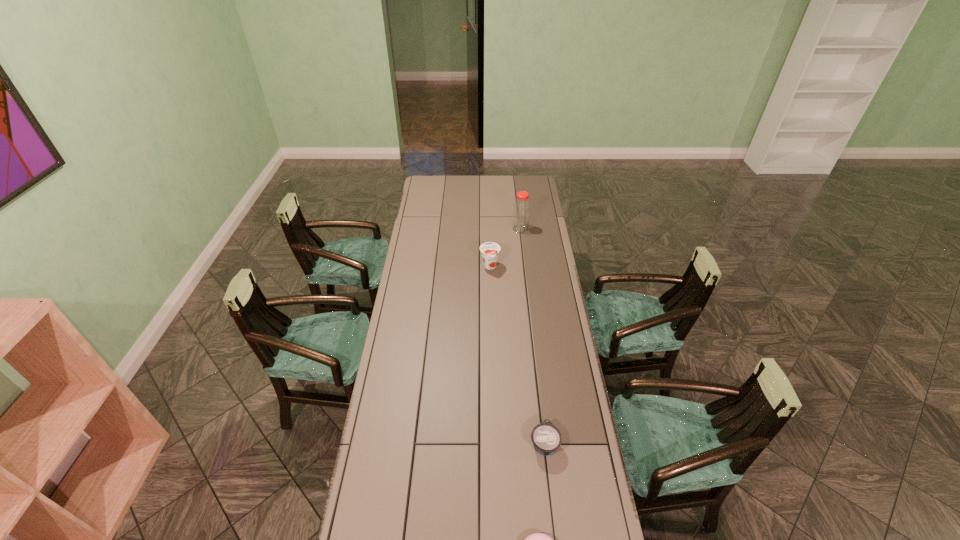
Locate which object ranks second in proximity to the nearest object. Please provide its 2D coordinates. Your answer should be formatted as a tuple, i.e. [(x, y)], where the tuple contains the x and y coordinates of a point satisfying the conditions above.

[(489, 250)]

In order to click on object that is the second nearest to the nearest object in this screenshot , I will do (489, 250).

The width and height of the screenshot is (960, 540). What are the coordinates of `vacant space that satisfies the following two spatial constraints: 1. on the front side of the farther yogurt; 2. on the left side of the second nearest object` in the screenshot? It's located at (494, 444).

Find the location of a particular element. vacant point that satisfies the following two spatial constraints: 1. on the back side of the tallest object; 2. on the left side of the shorter yogurt is located at coordinates (520, 228).

Identify the location of blank space that satisfies the following two spatial constraints: 1. on the back side of the tallest object; 2. on the right side of the shorter yogurt. This screenshot has width=960, height=540. coord(520,228).

Identify the location of free space in the image that satisfies the following two spatial constraints: 1. on the back side of the tallest object; 2. on the left side of the taller yogurt. This screenshot has height=540, width=960. (489, 228).